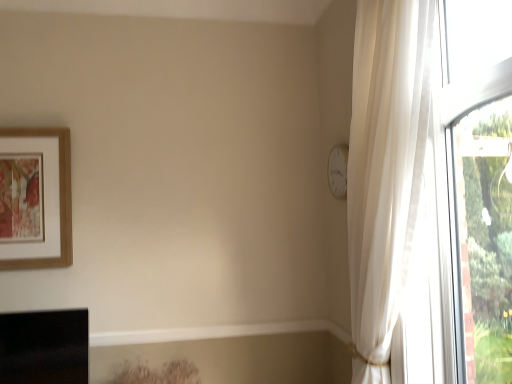
Question: Is wooden-framed artwork at upper left at the left side of white matte clock at upper right?

Choices:
 (A) yes
 (B) no

Answer: (A)

Question: Is wooden-framed artwork at upper left aimed at white matte clock at upper right?

Choices:
 (A) yes
 (B) no

Answer: (B)

Question: Is wooden-framed artwork at upper left at the right side of white matte clock at upper right?

Choices:
 (A) no
 (B) yes

Answer: (A)

Question: Is wooden-framed artwork at upper left shorter than white matte clock at upper right?

Choices:
 (A) yes
 (B) no

Answer: (B)

Question: Would you say wooden-framed artwork at upper left contains white matte clock at upper right?

Choices:
 (A) no
 (B) yes

Answer: (A)

Question: From a real-world perspective, is wooden-framed artwork at upper left positioned over white matte clock at upper right based on gravity?

Choices:
 (A) yes
 (B) no

Answer: (B)

Question: From the image's perspective, would you say white matte clock at upper right is shown under wooden-framed artwork at upper left?

Choices:
 (A) yes
 (B) no

Answer: (B)

Question: Is white matte clock at upper right wider than wooden-framed artwork at upper left?

Choices:
 (A) no
 (B) yes

Answer: (A)

Question: Is white matte clock at upper right not close to wooden-framed artwork at upper left?

Choices:
 (A) no
 (B) yes

Answer: (B)

Question: Is white matte clock at upper right thinner than wooden-framed artwork at upper left?

Choices:
 (A) no
 (B) yes

Answer: (B)

Question: Considering the relative sizes of white matte clock at upper right and wooden-framed artwork at upper left in the image provided, is white matte clock at upper right shorter than wooden-framed artwork at upper left?

Choices:
 (A) no
 (B) yes

Answer: (B)

Question: From a real-world perspective, is white matte clock at upper right located beneath wooden-framed artwork at upper left?

Choices:
 (A) yes
 (B) no

Answer: (B)

Question: Is white matte clock at upper right in front of or behind wooden-framed artwork at upper left in the image?

Choices:
 (A) front
 (B) behind

Answer: (A)